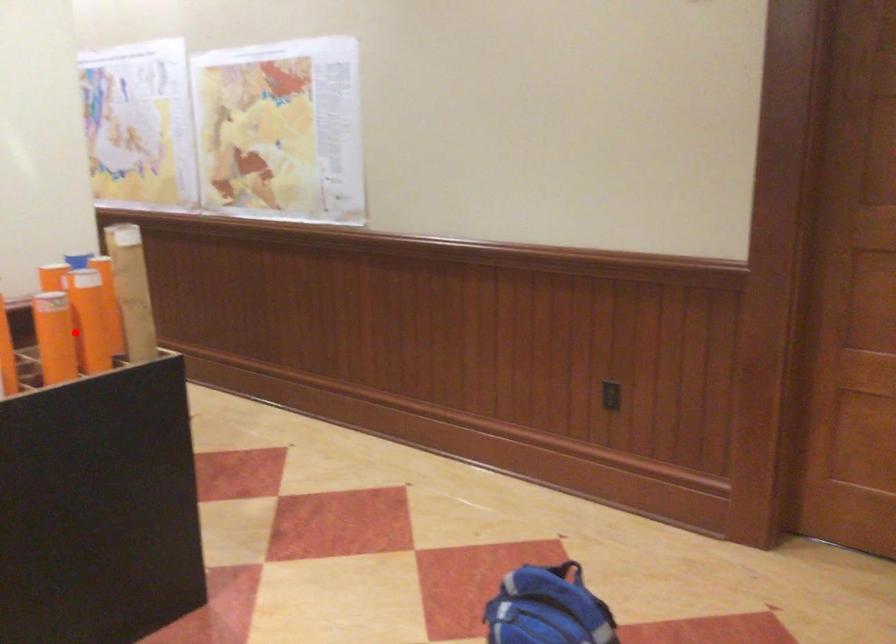
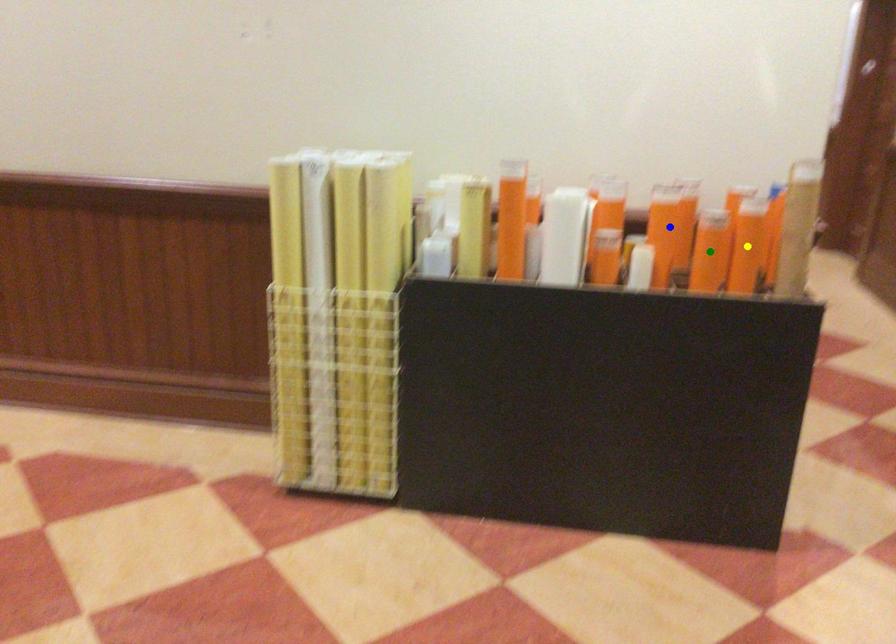
Question: I am providing you with two images of the same scene from different viewpoints. A red point is marked on the first image. You are given multiple points on the second image. Which mark in image 2 goes with the point in image 1?

Choices:
 (A) blue point
 (B) yellow point
 (C) green point

Answer: (C)